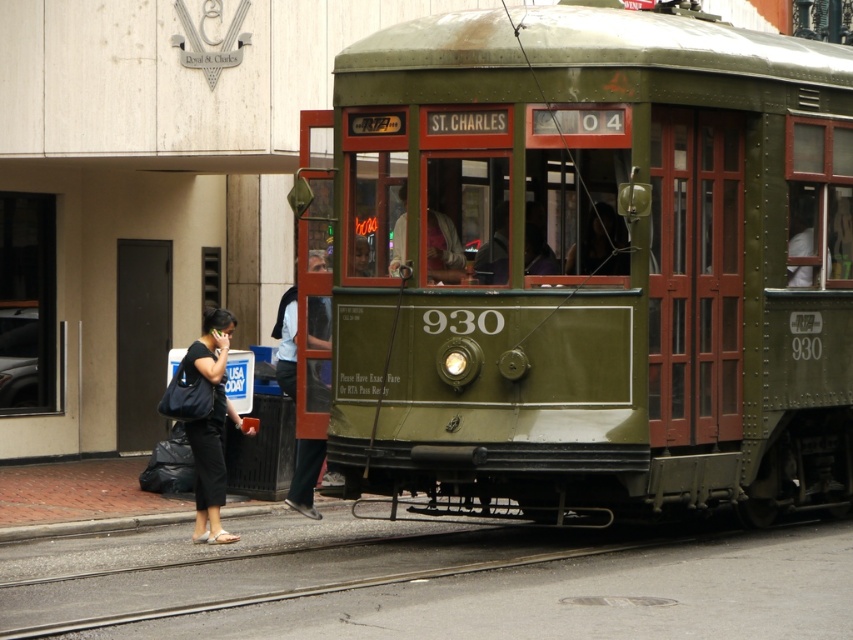
Is black asphalt train track at lower center positioned in front of dark blue jeans at center?

Yes, black asphalt train track at lower center is in front of dark blue jeans at center.

From the picture: Does black asphalt train track at lower center have a greater height compared to dark blue jeans at center?

No, black asphalt train track at lower center is not taller than dark blue jeans at center.

Between point (802, 586) and point (281, 387), which one is positioned in front?

Point (802, 586)

Find the location of a particular element. The image size is (853, 640). black asphalt train track at lower center is located at coordinates (433, 580).

I want to click on green metal train car at center, so click(585, 262).

Can you confirm if green metal train car at center is wider than dark blue jeans at center?

Yes.

This screenshot has height=640, width=853. What are the coordinates of `green metal train car at center` in the screenshot? It's located at (585, 262).

At what (x,y) coordinates should I click in order to perform the action: click on green metal train car at center. Please return your answer as a coordinate pair (x, y). Looking at the image, I should click on (585, 262).

At what (x,y) coordinates should I click in order to perform the action: click on green metal train car at center. Please return your answer as a coordinate pair (x, y). This screenshot has width=853, height=640. Looking at the image, I should click on (585, 262).

From the picture: Which is more to the right, green metal train car at center or black fabric bag at lower left?

green metal train car at center

This screenshot has width=853, height=640. What do you see at coordinates (585, 262) in the screenshot?
I see `green metal train car at center` at bounding box center [585, 262].

Where is `green metal train car at center`? green metal train car at center is located at coordinates (585, 262).